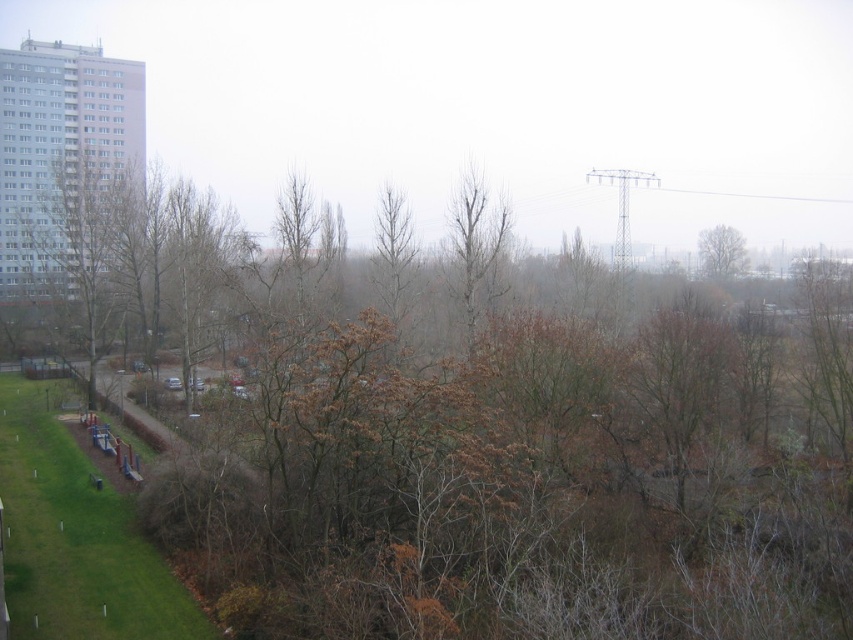
Is bare branches at center closer to camera compared to brown leafless tree at upper right?

That is True.

Does bare branches at center appear under brown leafless tree at upper right?

Indeed, bare branches at center is positioned under brown leafless tree at upper right.

Is point (490, 250) positioned after point (721, 225)?

No, it is not.

The width and height of the screenshot is (853, 640). I want to click on bare branches at center, so pyautogui.click(x=474, y=248).

Which of these two, brown leafless tree at left or brown leafless tree at upper right, stands shorter?

brown leafless tree at upper right is shorter.

Based on the photo, is brown leafless tree at left smaller than brown leafless tree at upper right?

No, brown leafless tree at left is not smaller than brown leafless tree at upper right.

Measure the distance between point (100,196) and camera.

Point (100,196) is 70.58 meters from camera.

Find the location of a particular element. Image resolution: width=853 pixels, height=640 pixels. brown leafless tree at left is located at coordinates (82, 228).

In order to click on brown leafless tree at left in this screenshot , I will do `click(82, 228)`.

In the scene shown: Measure the distance between brown leafless tree at left and bare branches at center.

brown leafless tree at left is 99.29 feet from bare branches at center.

Is point (21, 168) positioned after point (488, 221)?

Yes.

Where is `brown leafless tree at left`? This screenshot has height=640, width=853. brown leafless tree at left is located at coordinates (82, 228).